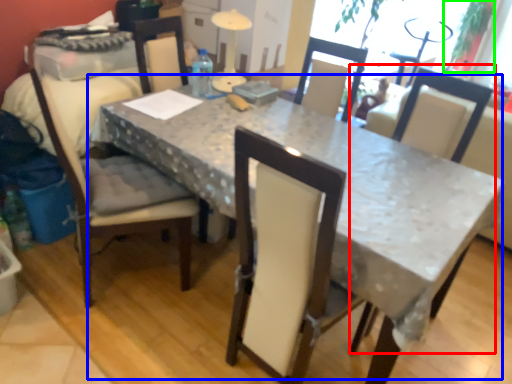
Question: Which object is positioned closest to chair (highlighted by a red box)? Select from table (highlighted by a blue box) and plant (highlighted by a green box).

Choices:
 (A) table
 (B) plant

Answer: (A)